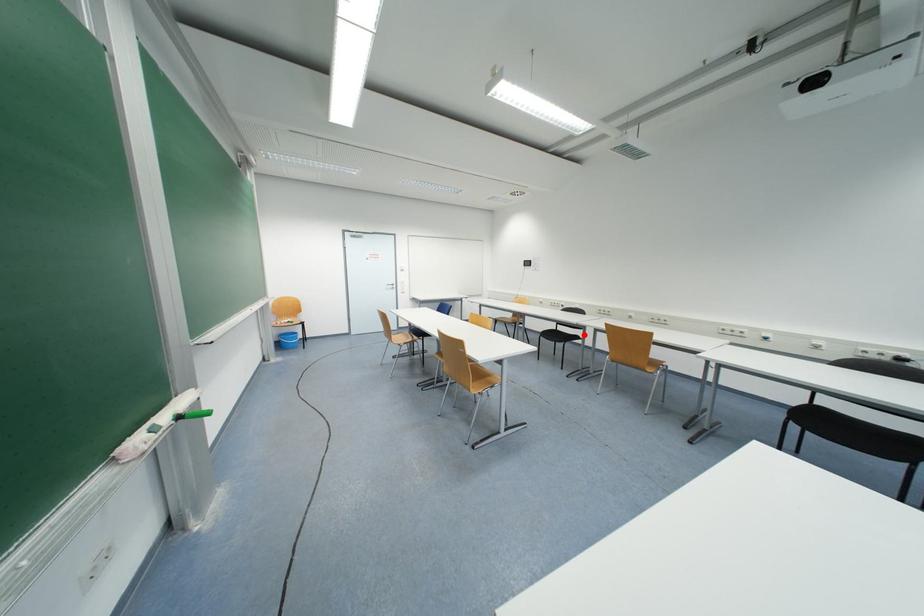
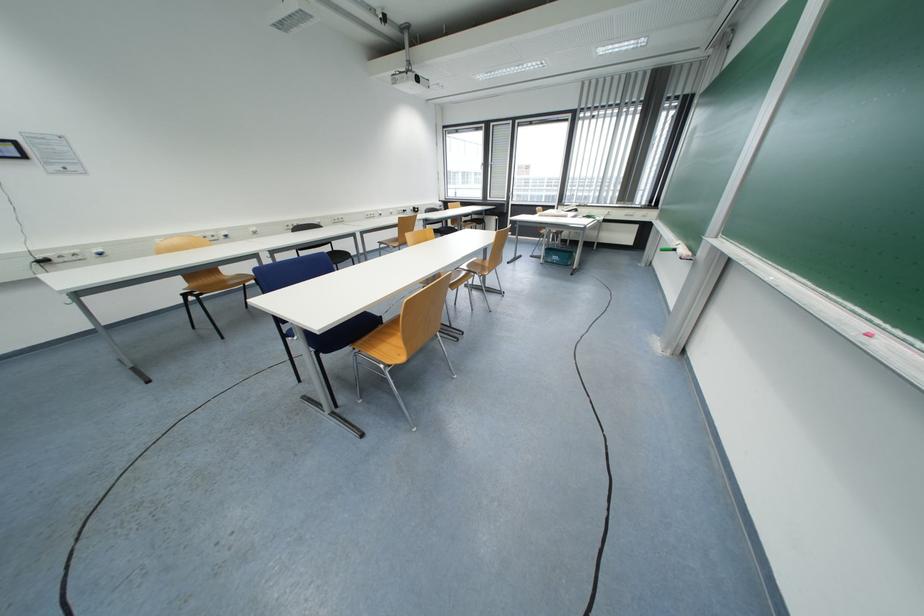
Find the pixel in the second image that matches the highlighted location in the first image.

(332, 251)